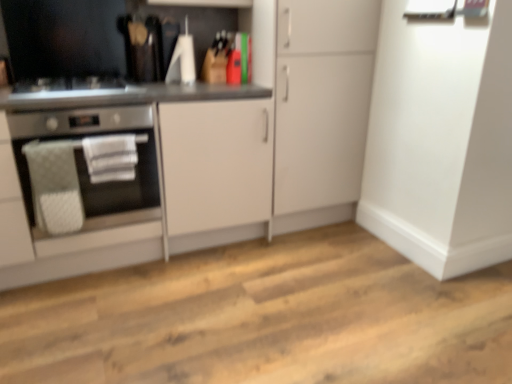
Question: Is white matte cabinet at center, which appears as the second cabinetry when viewed from the left, with matte white cabinet at center, which ranks as the second cabinetry in right-to-left order?

Choices:
 (A) no
 (B) yes

Answer: (A)

Question: From the image's perspective, is white matte cabinet at center, the 1th cabinetry viewed from the right, beneath matte white cabinet at center, which ranks as the second cabinetry in right-to-left order?

Choices:
 (A) no
 (B) yes

Answer: (A)

Question: Does white matte cabinet at center, which appears as the second cabinetry when viewed from the left, have a lesser width compared to matte white cabinet at center, which ranks as the second cabinetry in right-to-left order?

Choices:
 (A) no
 (B) yes

Answer: (B)

Question: From the image's perspective, is white matte cabinet at center, the 1th cabinetry viewed from the right, over matte white cabinet at center, the first cabinetry positioned from the left?

Choices:
 (A) no
 (B) yes

Answer: (B)

Question: Can you confirm if white matte cabinet at center, the 1th cabinetry viewed from the right, is wider than matte white cabinet at center, which ranks as the second cabinetry in right-to-left order?

Choices:
 (A) no
 (B) yes

Answer: (A)

Question: Is white matte cabinet at center, the 1th cabinetry viewed from the right, inside the boundaries of satin black gas stove at left, or outside?

Choices:
 (A) outside
 (B) inside

Answer: (A)

Question: In the image, is white matte cabinet at center, which appears as the second cabinetry when viewed from the left, on the left side or the right side of satin black gas stove at left?

Choices:
 (A) left
 (B) right

Answer: (B)

Question: Is point (285, 82) positioned closer to the camera than point (142, 87)?

Choices:
 (A) farther
 (B) closer

Answer: (A)

Question: Is white matte cabinet at center, the 1th cabinetry viewed from the right, bigger or smaller than satin black gas stove at left?

Choices:
 (A) big
 (B) small

Answer: (A)

Question: From the image's perspective, is satin black gas stove at left located above or below stainless steel oven at left?

Choices:
 (A) above
 (B) below

Answer: (A)

Question: Is point (56, 79) positioned closer to the camera than point (31, 117)?

Choices:
 (A) closer
 (B) farther

Answer: (B)

Question: In the image, is satin black gas stove at left positioned in front of or behind stainless steel oven at left?

Choices:
 (A) front
 (B) behind

Answer: (B)

Question: Would you say satin black gas stove at left is inside or outside stainless steel oven at left?

Choices:
 (A) inside
 (B) outside

Answer: (B)

Question: From a real-world perspective, is satin black gas stove at left above or below matte white cabinet at center, the first cabinetry positioned from the left?

Choices:
 (A) below
 (B) above

Answer: (B)

Question: In terms of size, does satin black gas stove at left appear bigger or smaller than matte white cabinet at center, the first cabinetry positioned from the left?

Choices:
 (A) small
 (B) big

Answer: (A)